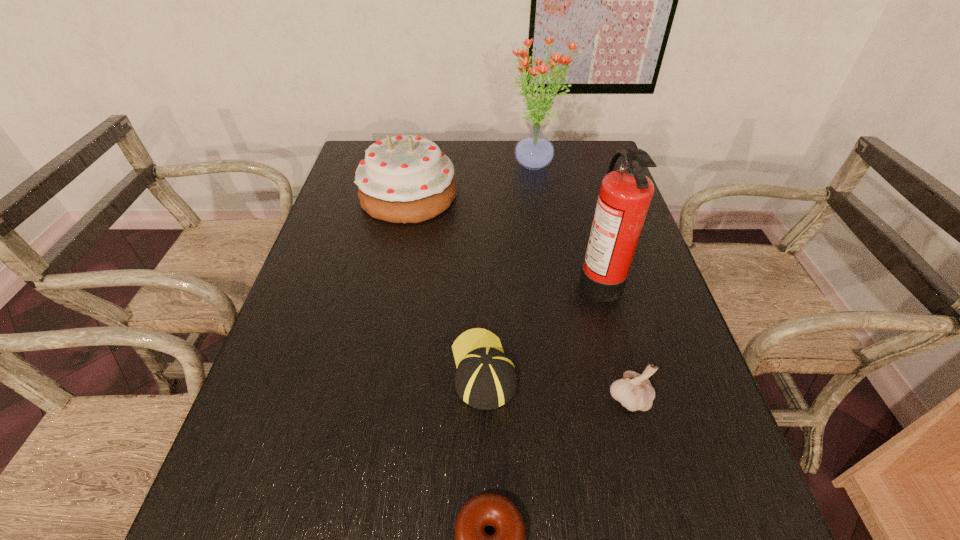
Where is `vacant space located on the right of the leftmost object`? The height and width of the screenshot is (540, 960). vacant space located on the right of the leftmost object is located at coordinates (515, 195).

In order to click on free space located on the left of the garlic in this screenshot , I will do `click(496, 398)`.

You are a GUI agent. You are given a task and a screenshot of the screen. Output one action in this format:
    pyautogui.click(x=<x>, y=<y>)
    Task: Click on the vacant space located 0.180m with the brim of the baseball cap facing forward
    
    Given the screenshot: What is the action you would take?
    pyautogui.click(x=483, y=276)

Identify the location of vacant region located 0.390m with the brim of the baseball cap facing forward. The height and width of the screenshot is (540, 960). (483, 225).

At what (x,y) coordinates should I click in order to perform the action: click on free space located 0.160m with the brim of the baseball cap facing forward. Please return your answer as a coordinate pair (x, y). The width and height of the screenshot is (960, 540). Looking at the image, I should click on (483, 282).

Identify the location of flower arrangement that is at the far edge. This screenshot has width=960, height=540. (534, 151).

Find the location of `cake that is at the far edge`. cake that is at the far edge is located at coordinates (404, 179).

Identify the location of object that is at the left edge. This screenshot has height=540, width=960. (404, 179).

Find the location of a particular element. flower arrangement at the right edge is located at coordinates point(534,151).

I want to click on fire extinguisher that is at the right edge, so click(x=625, y=195).